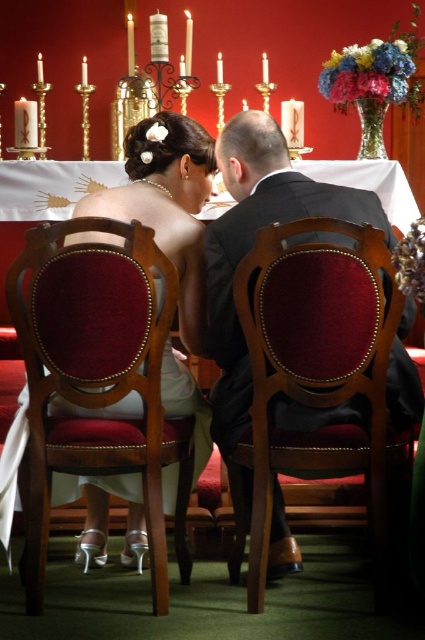
Who is taller, velvet red chair at left or velvet red chair at center?

Standing taller between the two is velvet red chair at left.

Which is in front, point (138, 456) or point (274, 346)?

Point (274, 346) is in front.

Where is `velvet red chair at left`? The width and height of the screenshot is (425, 640). velvet red chair at left is located at coordinates (98, 378).

Is velvet red chair at left to the right of satin white dress at center from the viewer's perspective?

No, velvet red chair at left is not to the right of satin white dress at center.

In the scene shown: Who is positioned more to the right, velvet red chair at left or satin white dress at center?

Positioned to the right is satin white dress at center.

Does point (130, 442) lie behind point (167, 496)?

No, it is not.

The image size is (425, 640). I want to click on velvet red chair at left, so 98,378.

You are a GUI agent. You are given a task and a screenshot of the screen. Output one action in this format:
    pyautogui.click(x=<x>, y=<y>)
    Task: Click on the velvet red chair at center
    The image size is (425, 640).
    Given the screenshot: What is the action you would take?
    pyautogui.click(x=316, y=376)

Who is shorter, velvet red chair at center or satin white dress at center?

satin white dress at center

Is point (325, 272) positioned after point (135, 529)?

No, (325, 272) is in front of (135, 529).

In order to click on velvet red chair at center in this screenshot , I will do `click(316, 376)`.